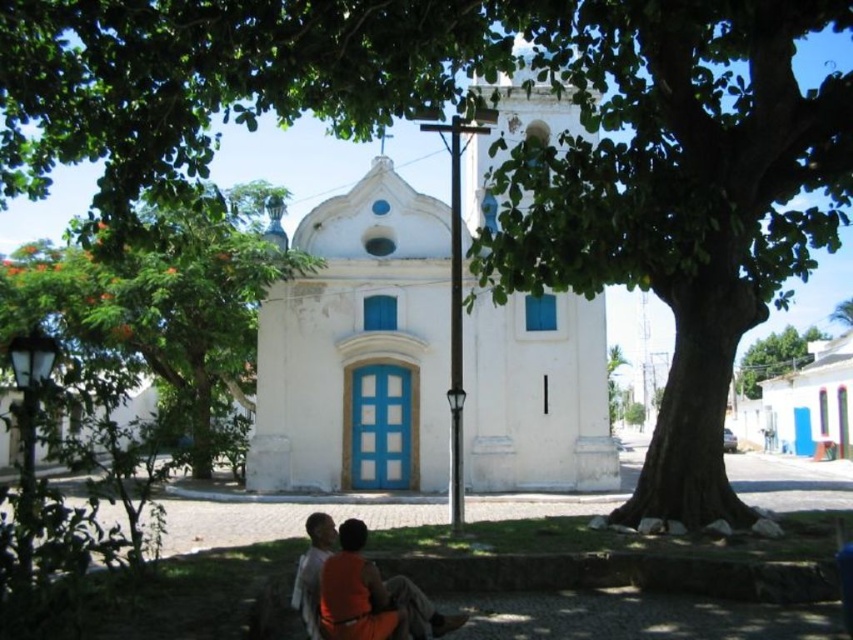
In the scene shown: Can you confirm if green leafy tree at upper right is shorter than orange fabric shirt at lower center?

No, green leafy tree at upper right is not shorter than orange fabric shirt at lower center.

Between green leafy tree at upper right and orange fabric shirt at lower center, which one has less height?

orange fabric shirt at lower center

Is point (811, 340) positioned in front of point (318, 628)?

That is False.

Identify the location of green leafy tree at upper right. The image size is (853, 640). (775, 356).

Between point (734, 508) and point (346, 614), which one is positioned behind?

Positioned behind is point (734, 508).

Does point (706, 260) lie behind point (372, 579)?

Yes.

The image size is (853, 640). What are the coordinates of `green leafy tree at center` in the screenshot? It's located at (679, 196).

Who is taller, green leafy tree at center or white smooth chapel at center?

green leafy tree at center

This screenshot has height=640, width=853. I want to click on green leafy tree at center, so click(x=679, y=196).

Identify the location of green leafy tree at center. Image resolution: width=853 pixels, height=640 pixels. point(679,196).